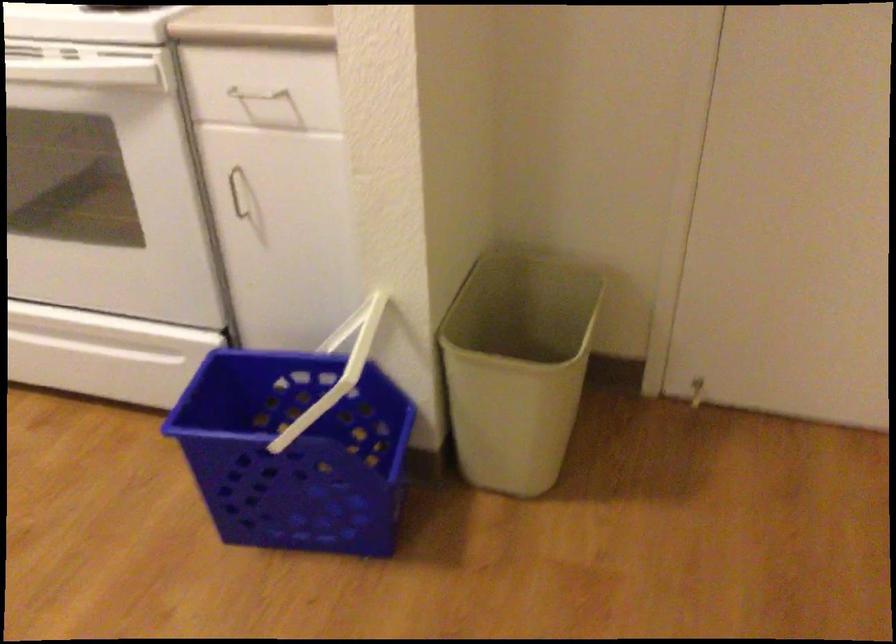
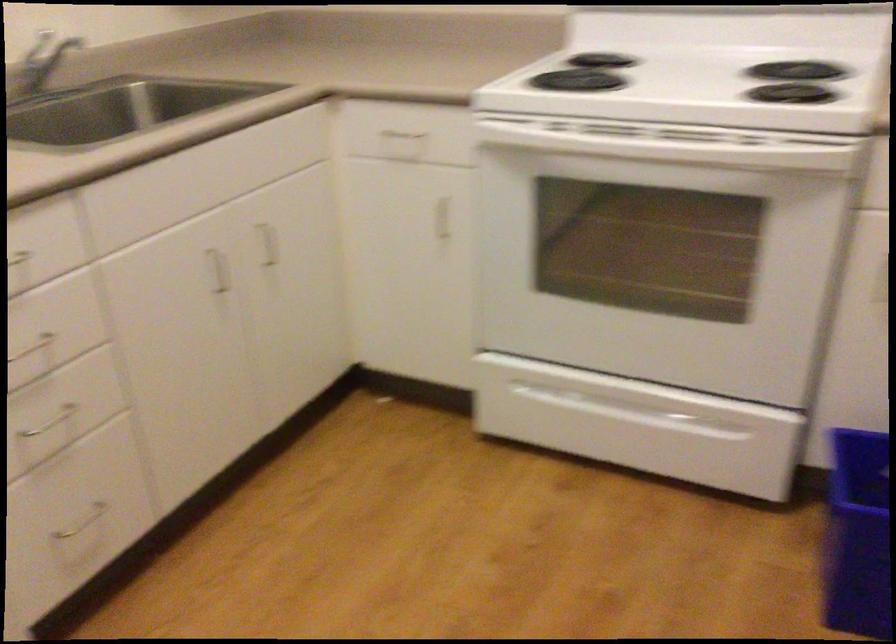
Question: The first image is from the beginning of the video and the second image is from the end. How did the camera likely rotate when shooting the video?

Choices:
 (A) Left
 (B) Right
 (C) Up
 (D) Down

Answer: (A)